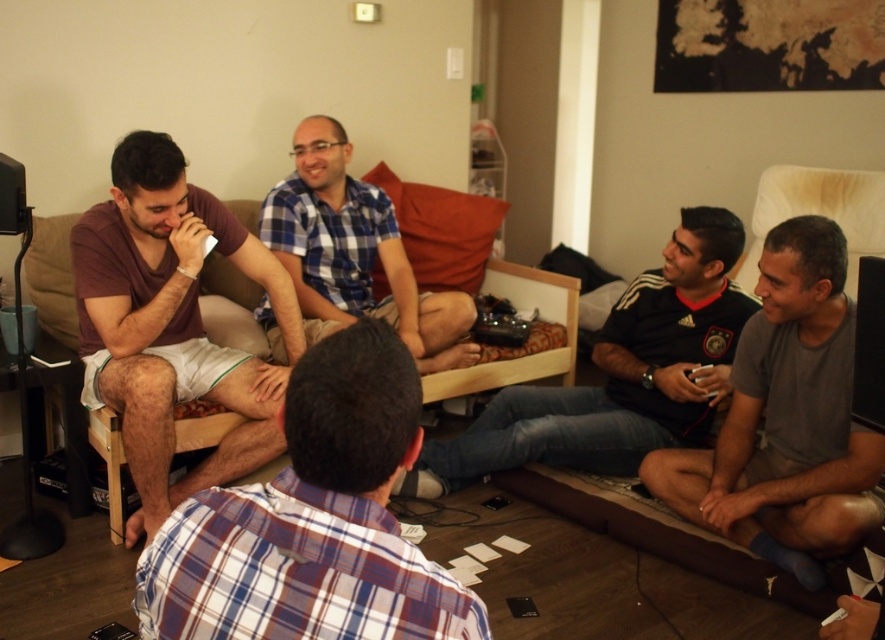
Question: Is gray cotton shirt at lower right wider than blue plaid shirt at center?

Choices:
 (A) no
 (B) yes

Answer: (A)

Question: Is plaid shirt at center wider than gray cotton shirt at lower right?

Choices:
 (A) no
 (B) yes

Answer: (A)

Question: Does matte brown shorts at left have a larger size compared to dark gray jersey at center?

Choices:
 (A) no
 (B) yes

Answer: (A)

Question: Which of the following is the closest to the observer?

Choices:
 (A) matte brown shorts at left
 (B) dark gray jersey at center
 (C) brown fabric couch at upper center
 (D) plaid shirt at center

Answer: (D)

Question: Which point is closer to the camera?

Choices:
 (A) brown fabric couch at upper center
 (B) matte brown shorts at left
 (C) dark gray jersey at center

Answer: (B)

Question: Among these objects, which one is farthest from the camera?

Choices:
 (A) blue plaid shirt at center
 (B) plaid shirt at center
 (C) gray cotton shirt at lower right
 (D) brown fabric couch at upper center

Answer: (D)